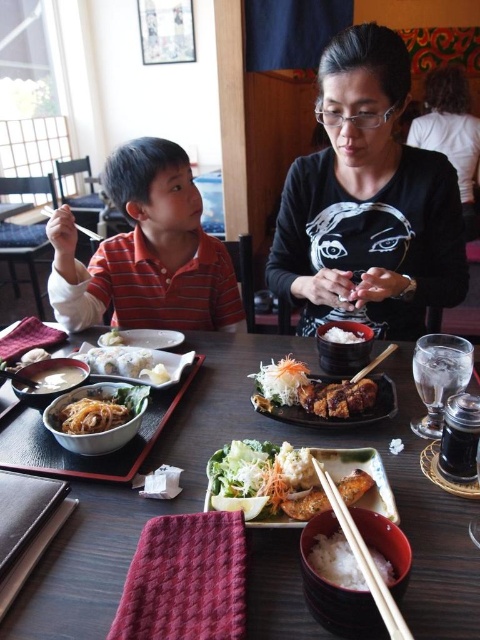
Question: Is wooden chopsticks at lower center below white matte plate at lower left?

Choices:
 (A) no
 (B) yes

Answer: (B)

Question: Among these points, which one is nearest to the camera?

Choices:
 (A) (140, 340)
 (B) (54, 212)

Answer: (B)

Question: Estimate the real-world distances between objects in this image. Which object is farther from the black matte shirt at center?

Choices:
 (A) orange striped polo shirt at left
 (B) smooth black bowl at center
 (C) crunchy fried chicken at center
 (D) shiny brown noodles at center

Answer: (D)

Question: Does white matte plate at lower left appear on the left side of wooden chopsticks at upper left?

Choices:
 (A) no
 (B) yes

Answer: (A)

Question: Observing the image, what is the correct spatial positioning of wooden table at center in reference to wooden chopsticks at upper left?

Choices:
 (A) above
 (B) below

Answer: (B)

Question: Which point is closer to the camera?

Choices:
 (A) wooden chopsticks at upper left
 (B) crunchy fried chicken at center

Answer: (B)